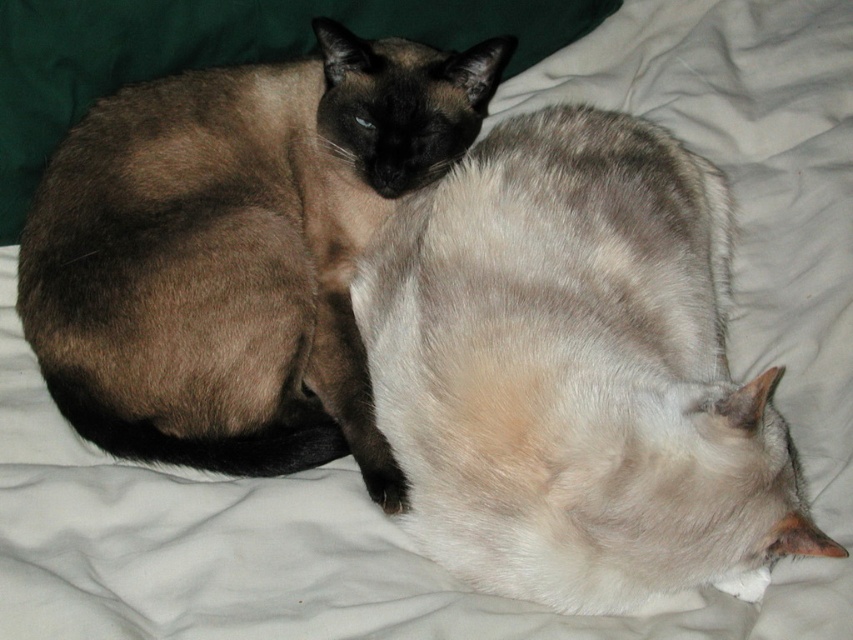
You are a photographer trying to capture both the silky white cat at center and the brown fur cat at upper left in a single shot. Since you want to ensure both cats are in focus, which cat should you adjust your camera focus on first considering their heights?

The silky white cat at center has a lesser height compared to the brown fur cat at upper left. Therefore, you should focus on the brown fur cat at upper left first because it is taller and adjusting focus on the taller object ensures both will be in focus.

Looking at this image, you are a photographer trying to capture both the silky white cat at center and the brown fur cat at upper left in a single frame. Given that the camera can only focus on objects within a 50 cm width, will both cats fit if the camera is positioned to include both?

The silky white cat at center has a lesser width compared to brown fur cat at upper left. However, without knowing the total combined width of both cats, it is impossible to determine if they will fit within the camera frame.